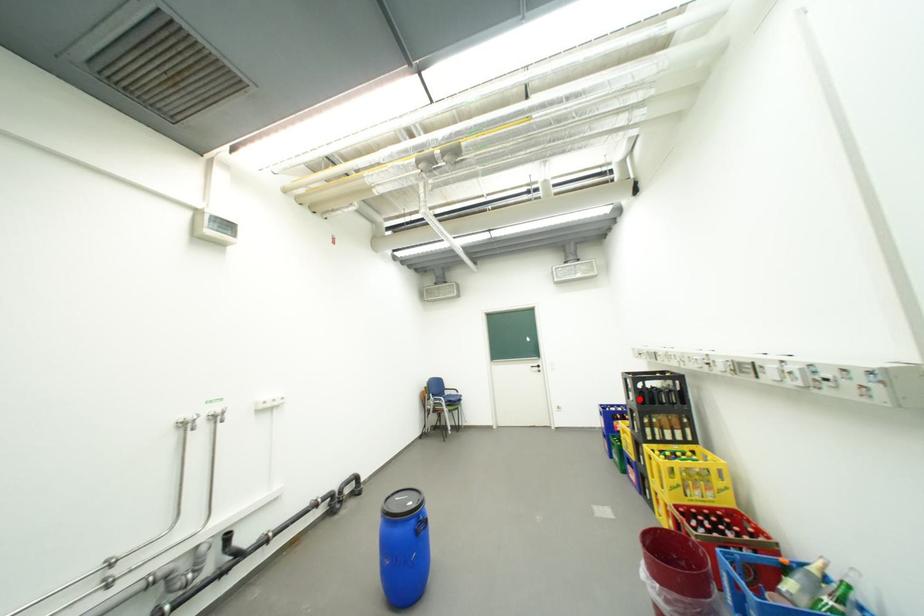
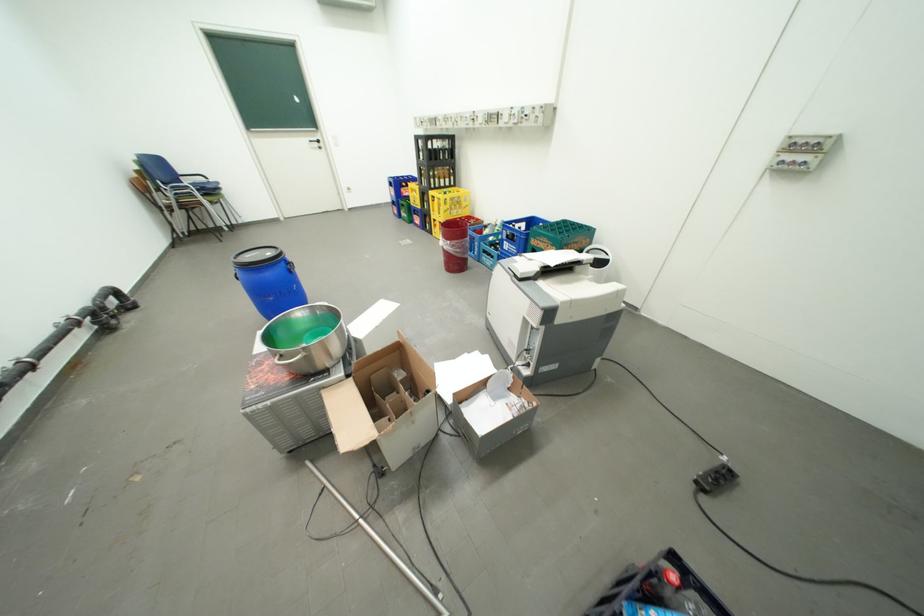
Question: A red point is marked in image1. In image2, is the corresponding 3D point closer to the camera or farther? Reply with the corresponding letter.

Choices:
 (A) The corresponding 3D point is closer.
 (B) The corresponding 3D point is farther.

Answer: (A)